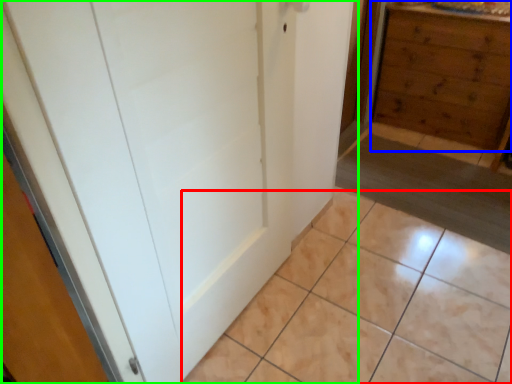
Question: Based on their relative distances, which object is nearer to ceramic tile (highlighted by a red box)? Choose from chest of drawers (highlighted by a blue box) and door (highlighted by a green box).

Choices:
 (A) chest of drawers
 (B) door

Answer: (B)